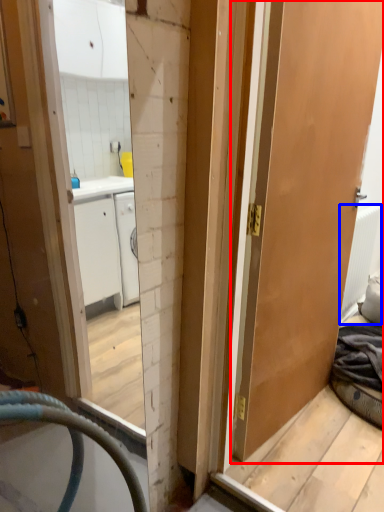
Question: Which object appears closest to the camera in this image, door (highlighted by a red box) or radiator (highlighted by a blue box)?

Choices:
 (A) door
 (B) radiator

Answer: (A)